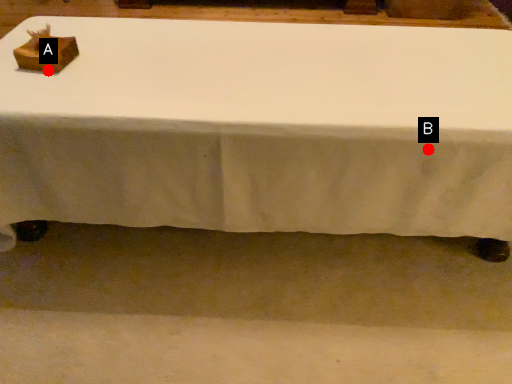
Question: Two points are circled on the image, labeled by A and B beside each circle. Which point is closer to the camera taking this photo?

Choices:
 (A) A is closer
 (B) B is closer

Answer: (B)